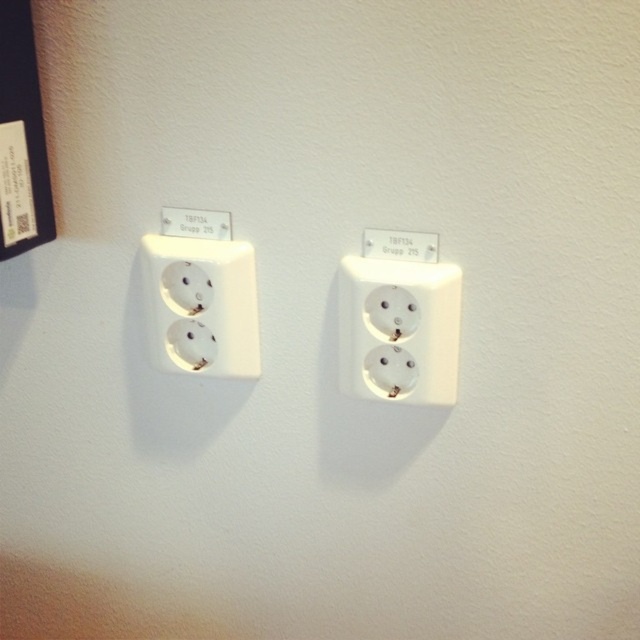
Which is behind, point (451, 397) or point (164, 310)?

Positioned behind is point (164, 310).

Measure the distance between point (378, 378) and camera.

Point (378, 378) and camera are 31.92 inches apart.

The width and height of the screenshot is (640, 640). Identify the location of white plastic outlet at center. (397, 330).